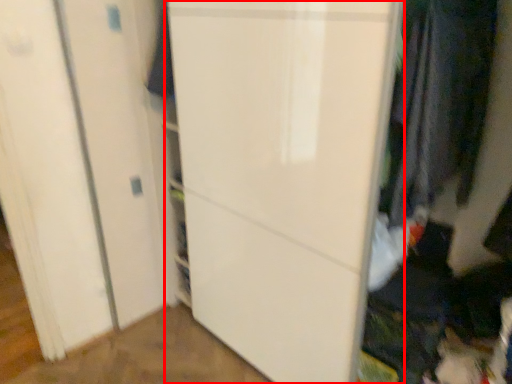
Question: Observing the image, what is the correct spatial positioning of door (annotated by the red box) in reference to clothing?

Choices:
 (A) left
 (B) right

Answer: (A)